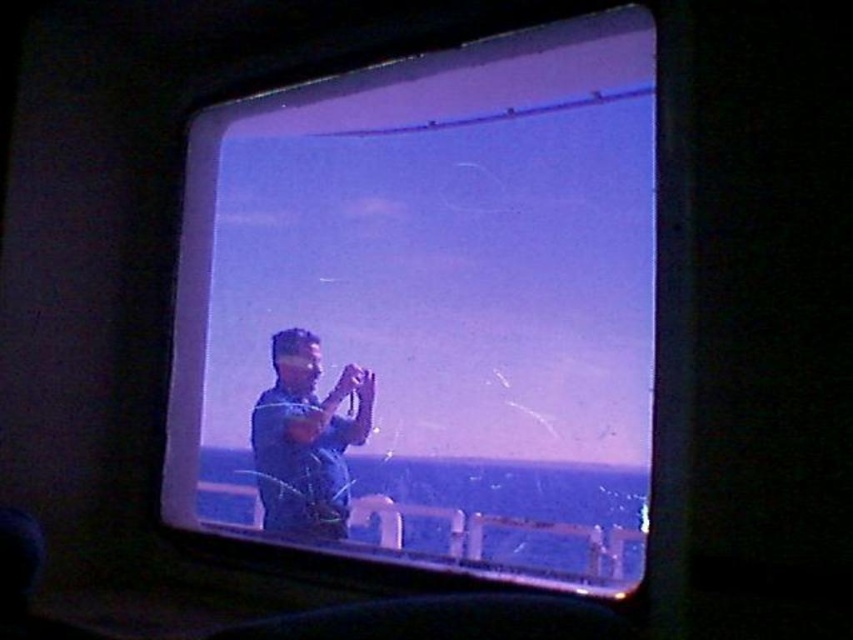
Question: Does transparent glass airplane window at center appear over blue fabric shirt at center?

Choices:
 (A) yes
 (B) no

Answer: (A)

Question: Is the position of transparent glass airplane window at center less distant than that of blue fabric shirt at center?

Choices:
 (A) no
 (B) yes

Answer: (B)

Question: Which point is closer to the camera?

Choices:
 (A) (485, 104)
 (B) (311, 492)

Answer: (B)

Question: Is transparent glass airplane window at center wider than blue fabric shirt at center?

Choices:
 (A) no
 (B) yes

Answer: (B)

Question: Which object is closer to the camera taking this photo?

Choices:
 (A) blue fabric shirt at center
 (B) transparent glass airplane window at center

Answer: (B)

Question: Which point is farther to the camera?

Choices:
 (A) blue fabric shirt at center
 (B) transparent glass airplane window at center

Answer: (A)